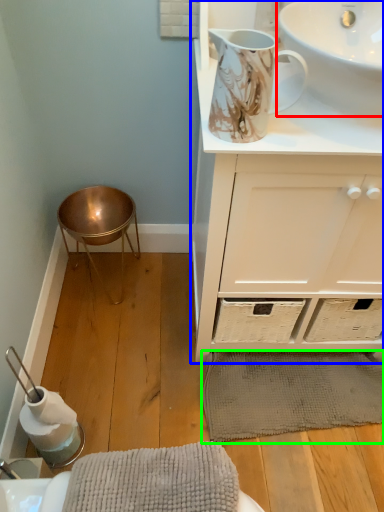
Question: Estimate the real-world distances between objects in this image. Which object is farther from sink (highlighted by a red box), bathroom cabinet (highlighted by a blue box) or bath mat (highlighted by a green box)?

Choices:
 (A) bathroom cabinet
 (B) bath mat

Answer: (B)